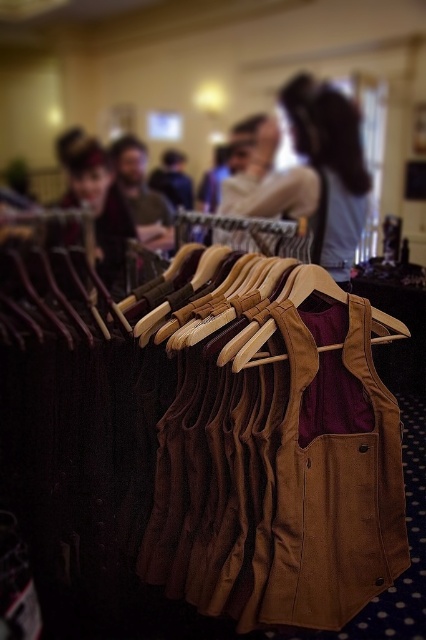
You are a tailor who needs to measure the space between two vests to ensure proper storage. The velvet burgundy vest at center and the brown suede vest at center are both on the same rack. Can you fit a 10 inch wide box between them?

The distance between the velvet burgundy vest at center and the brown suede vest at center is 10.85 inches. Since the box is 10 inches wide, it can fit between them with some space to spare.

You are trying to decide between two vests displayed on a rack. The light brown leather vest at center and the velvet burgundy vest at center. Which one is bigger?

The light brown leather vest at center has a larger size compared to the velvet burgundy vest at center, so the light brown leather vest at center is bigger.